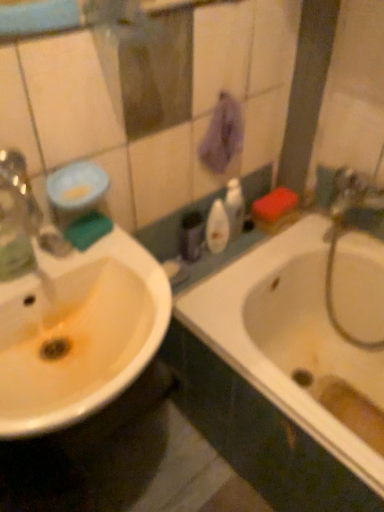
Where is `vacant space to the right of green sponge at left`? vacant space to the right of green sponge at left is located at coordinates (127, 256).